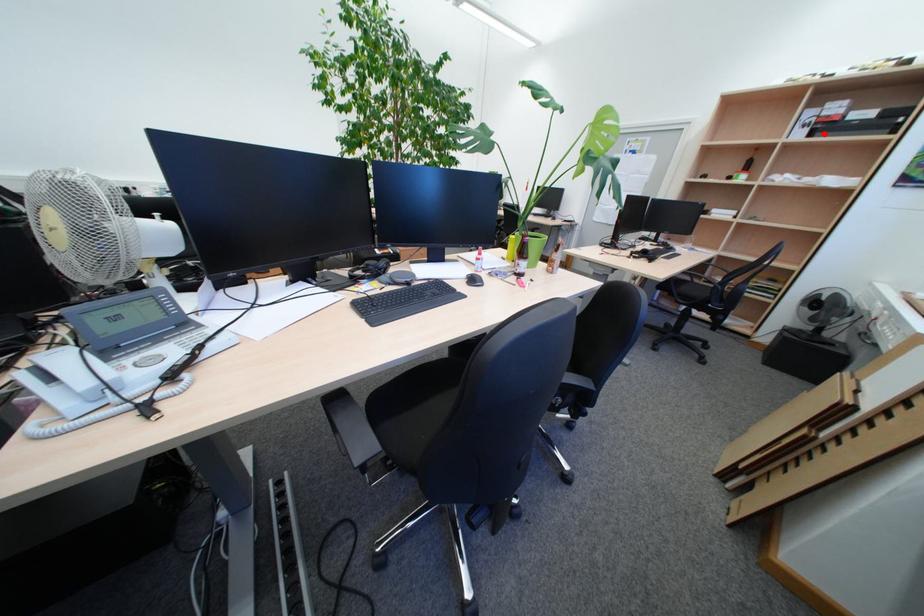
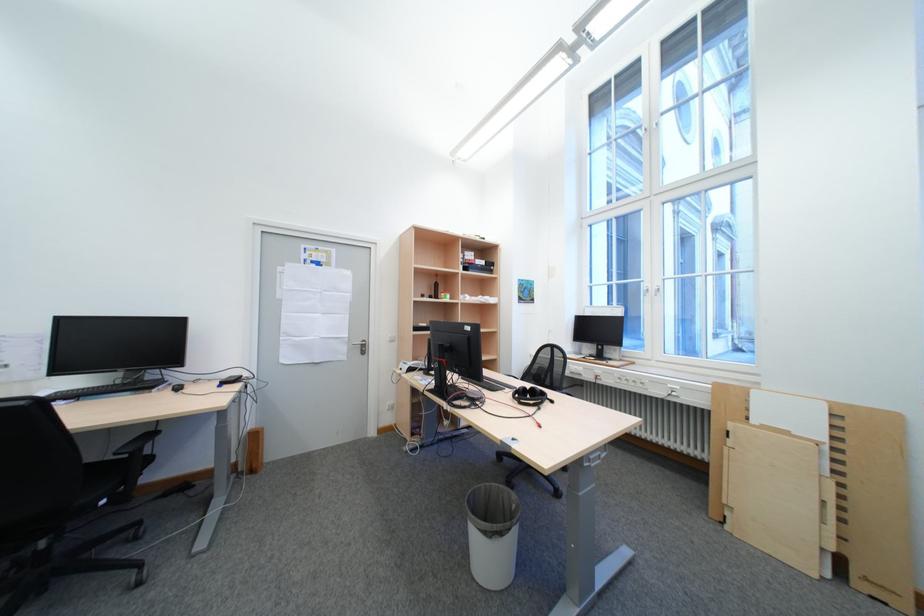
Locate, in the second image, the point that corresponds to the highlighted location in the first image.

(477, 270)